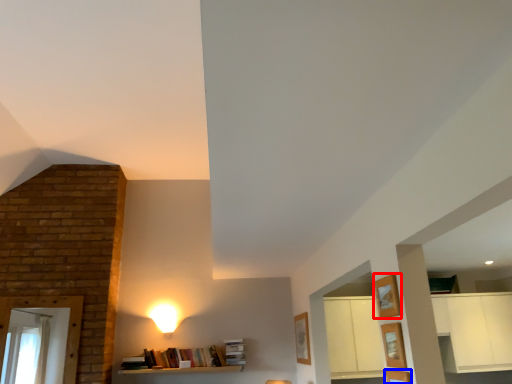
Question: Which object is closer to the camera taking this photo, shelf (highlighted by a red box) or shelf (highlighted by a blue box)?

Choices:
 (A) shelf
 (B) shelf

Answer: (B)